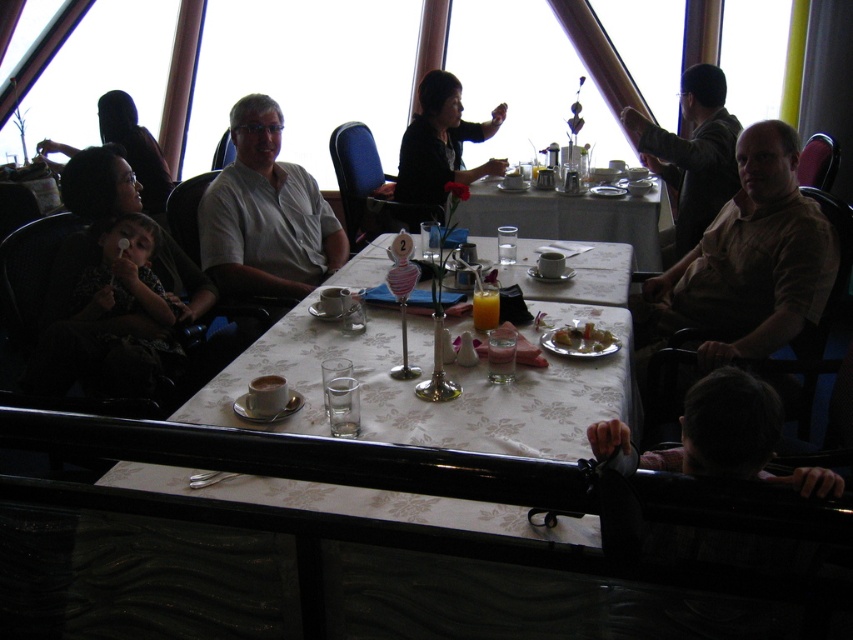
Question: Which of the following is the farthest from the observer?

Choices:
 (A) (434, 100)
 (B) (766, 433)
 (C) (199, 406)

Answer: (A)

Question: Which point is farther from the camera taking this photo?

Choices:
 (A) (167, 337)
 (B) (268, 173)
 (C) (474, 307)

Answer: (B)

Question: Which of the following is the farthest from the observer?

Choices:
 (A) (322, 196)
 (B) (107, 362)
 (C) (68, 186)
 (D) (544, 220)

Answer: (D)

Question: Can you confirm if white floral tablecloth at center is thinner than white tablecloth at center?

Choices:
 (A) no
 (B) yes

Answer: (A)

Question: Can you confirm if dark brown leather jacket at upper right is thinner than matte black child at left?

Choices:
 (A) no
 (B) yes

Answer: (A)

Question: Is brown textured shirt at right above dark brown hair at lower right?

Choices:
 (A) yes
 (B) no

Answer: (A)